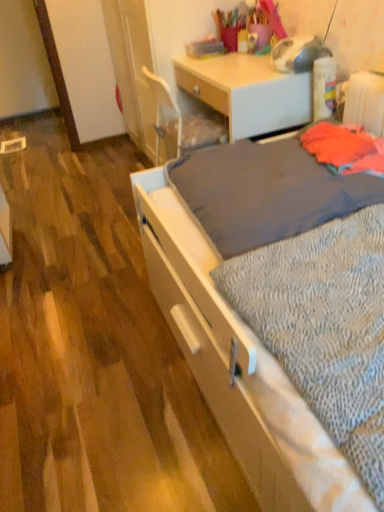
Question: Considering the positions of matte wood desk at center and textured gray blanket at center in the image, is matte wood desk at center bigger or smaller than textured gray blanket at center?

Choices:
 (A) small
 (B) big

Answer: (B)

Question: From the image's perspective, is matte wood desk at center above or below textured gray blanket at center?

Choices:
 (A) below
 (B) above

Answer: (B)

Question: Considering the real-world distances, which object is closest to the gray textured sheet at center?

Choices:
 (A) white wood bed at center
 (B) textured gray blanket at center
 (C) matte wood desk at center

Answer: (A)

Question: Which object is positioned closest to the textured gray blanket at center?

Choices:
 (A) gray textured sheet at center
 (B) white wood bed at center
 (C) matte wood desk at center

Answer: (B)